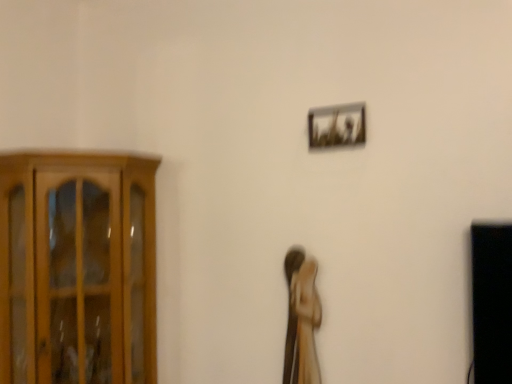
Question: Does metallic silver frame at upper right have a greater height compared to wooden cabinet at left?

Choices:
 (A) yes
 (B) no

Answer: (B)

Question: Is metallic silver frame at upper right not within wooden cabinet at left?

Choices:
 (A) no
 (B) yes

Answer: (B)

Question: Can you confirm if metallic silver frame at upper right is positioned to the right of wooden cabinet at left?

Choices:
 (A) yes
 (B) no

Answer: (A)

Question: Considering the relative sizes of metallic silver frame at upper right and wooden cabinet at left in the image provided, is metallic silver frame at upper right smaller than wooden cabinet at left?

Choices:
 (A) no
 (B) yes

Answer: (B)

Question: Is metallic silver frame at upper right behind wooden cabinet at left?

Choices:
 (A) no
 (B) yes

Answer: (B)

Question: In the image, is wooden statue at center positioned in front of or behind metallic silver frame at upper right?

Choices:
 (A) front
 (B) behind

Answer: (B)

Question: Would you say wooden statue at center is inside or outside metallic silver frame at upper right?

Choices:
 (A) inside
 (B) outside

Answer: (B)

Question: Is wooden statue at center to the left or to the right of metallic silver frame at upper right in the image?

Choices:
 (A) right
 (B) left

Answer: (B)

Question: Is wooden statue at center bigger or smaller than metallic silver frame at upper right?

Choices:
 (A) big
 (B) small

Answer: (A)

Question: Is metallic silver frame at upper right inside the boundaries of wooden statue at center, or outside?

Choices:
 (A) inside
 (B) outside

Answer: (B)

Question: Is metallic silver frame at upper right taller or shorter than wooden statue at center?

Choices:
 (A) short
 (B) tall

Answer: (A)

Question: Does point (328, 132) appear closer or farther from the camera than point (300, 306)?

Choices:
 (A) closer
 (B) farther

Answer: (A)

Question: From a real-world perspective, is metallic silver frame at upper right physically located above or below wooden statue at center?

Choices:
 (A) below
 (B) above

Answer: (B)

Question: Considering their positions, is metallic silver frame at upper right located in front of or behind wooden cabinet at left?

Choices:
 (A) front
 (B) behind

Answer: (B)

Question: Considering the relative positions of metallic silver frame at upper right and wooden cabinet at left in the image provided, is metallic silver frame at upper right to the left or to the right of wooden cabinet at left?

Choices:
 (A) right
 (B) left

Answer: (A)